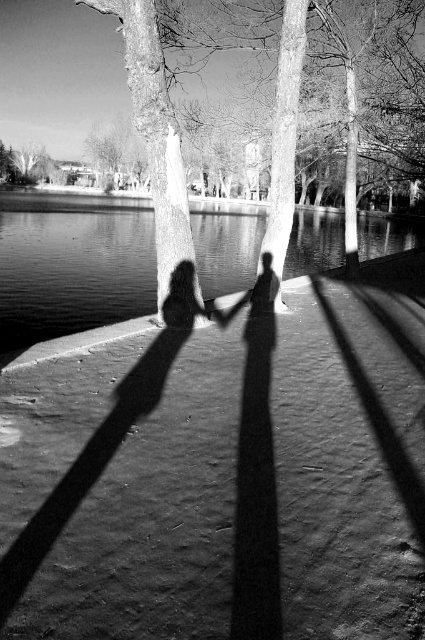
You are a hiker planning a route through the lakeside area. You see the smooth bark tree at upper center and the smooth bark tree at upper left in the distance. If your map shows that the path between them is 50 meters long, is the distance on your map accurate?

The distance between the smooth bark tree at upper center and the smooth bark tree at upper left is 45.54 meters, so the map showing 50 meters is not accurate.

You are standing on the paved pathway and see two trees with smooth bark. One is labeled as smooth bark tree at upper center and the other as smooth bark tree at upper left. From your perspective, which tree is positioned to the right of the other?

The smooth bark tree at upper center is positioned to the right of the smooth bark tree at upper left.